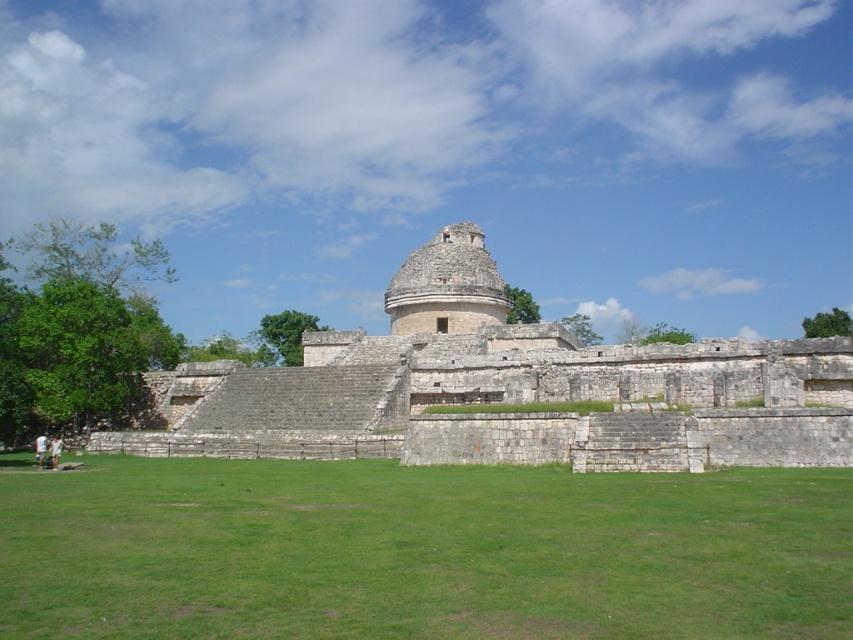
Is stone dome at center shorter than white stone dome at center?

In fact, stone dome at center may be taller than white stone dome at center.

Is stone dome at center to the left of white stone dome at center from the viewer's perspective?

Correct, you'll find stone dome at center to the left of white stone dome at center.

Is point (521, 422) closer to viewer compared to point (451, 268)?

Yes, it is.

Where is `stone dome at center`? stone dome at center is located at coordinates (506, 388).

Who is shorter, green grass at center or stone dome at center?

Standing shorter between the two is green grass at center.

What do you see at coordinates (421, 550) in the screenshot? I see `green grass at center` at bounding box center [421, 550].

Between point (70, 556) and point (521, 440), which one is positioned behind?

The point (521, 440) is more distant.

Locate an element on the screen. The width and height of the screenshot is (853, 640). green grass at center is located at coordinates (421, 550).

From the picture: Between green grass at center and white stone dome at center, which one appears on the right side from the viewer's perspective?

white stone dome at center

Can you confirm if green grass at center is shorter than white stone dome at center?

Yes, green grass at center is shorter than white stone dome at center.

Find the location of a particular element. This screenshot has height=640, width=853. green grass at center is located at coordinates (421, 550).

The height and width of the screenshot is (640, 853). What are the coordinates of `green grass at center` in the screenshot? It's located at (421, 550).